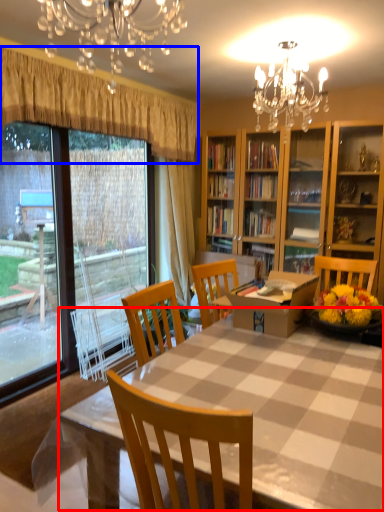
Question: Which object appears closest to the camera in this image, kitchen & dining room table (highlighted by a red box) or curtain (highlighted by a blue box)?

Choices:
 (A) kitchen & dining room table
 (B) curtain

Answer: (A)